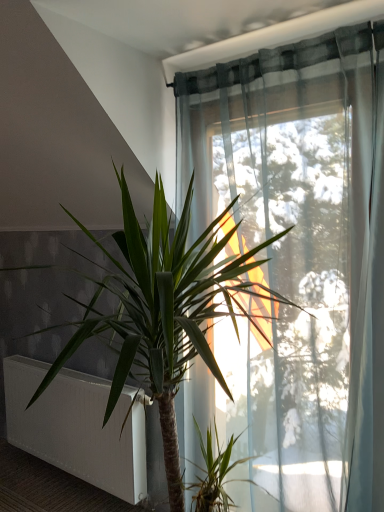
Question: From a real-world perspective, relative to white matte radiator at lower left, is green leafy plant at center vertically above or below?

Choices:
 (A) above
 (B) below

Answer: (A)

Question: Does point (170, 429) appear closer or farther from the camera than point (74, 423)?

Choices:
 (A) farther
 (B) closer

Answer: (B)

Question: In terms of height, does green leafy plant at center look taller or shorter compared to white matte radiator at lower left?

Choices:
 (A) tall
 (B) short

Answer: (A)

Question: Is white matte radiator at lower left bigger or smaller than green leafy plant at center?

Choices:
 (A) big
 (B) small

Answer: (B)

Question: Is white matte radiator at lower left in front of or behind green leafy plant at center in the image?

Choices:
 (A) front
 (B) behind

Answer: (B)

Question: Is white matte radiator at lower left inside or outside of green leafy plant at center?

Choices:
 (A) inside
 (B) outside

Answer: (B)

Question: Looking at their shapes, would you say white matte radiator at lower left is wider or thinner than green leafy plant at center?

Choices:
 (A) wide
 (B) thin

Answer: (B)